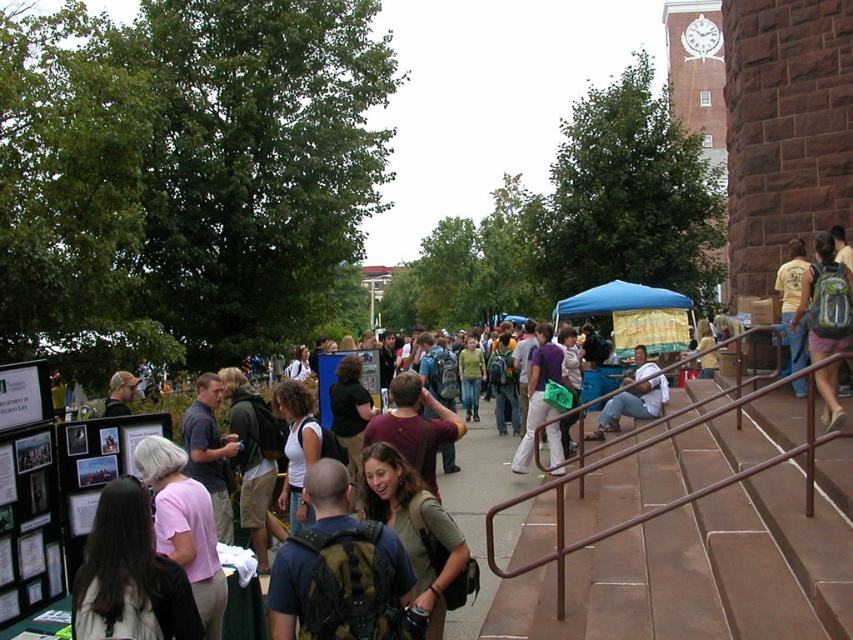
Does matte purple shirt at center appear on the right side of light brown backpack at center?

Incorrect, matte purple shirt at center is not on the right side of light brown backpack at center.

Which is more to the left, matte purple shirt at center or light brown backpack at center?

matte purple shirt at center is more to the left.

Which is in front, point (531, 384) or point (650, 362)?

Positioned in front is point (531, 384).

Find the location of a particular element. matte purple shirt at center is located at coordinates (541, 403).

Is green fabric backpack at center bigger than light brown backpack at center?

No, green fabric backpack at center is not bigger than light brown backpack at center.

Between green fabric backpack at center and light brown backpack at center, which one has more height?

green fabric backpack at center is taller.

This screenshot has width=853, height=640. What do you see at coordinates (418, 532) in the screenshot?
I see `green fabric backpack at center` at bounding box center [418, 532].

Find the location of `green fabric backpack at center`. green fabric backpack at center is located at coordinates (418, 532).

From the picture: Who is lower down, brown metal railing at center or green fabric backpack at center?

green fabric backpack at center

Which is above, brown metal railing at center or green fabric backpack at center?

brown metal railing at center is above.

Locate an element on the screen. brown metal railing at center is located at coordinates (698, 573).